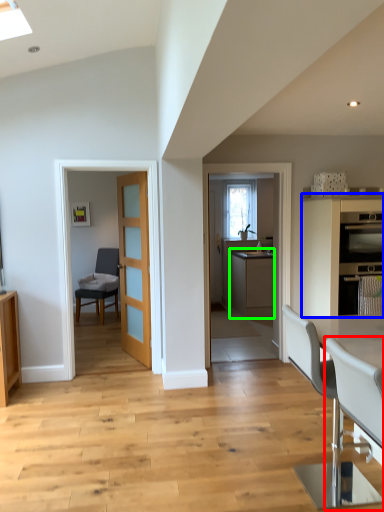
Question: Which object is the closest to the chair (highlighted by a red box)? Choose among these: cabinetry (highlighted by a blue box) or cabinetry (highlighted by a green box).

Choices:
 (A) cabinetry
 (B) cabinetry

Answer: (A)